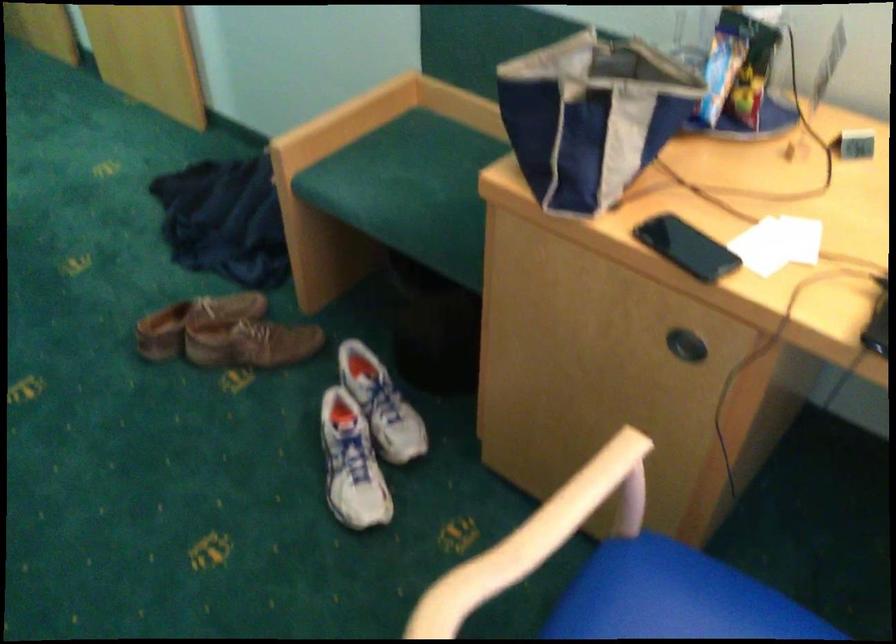
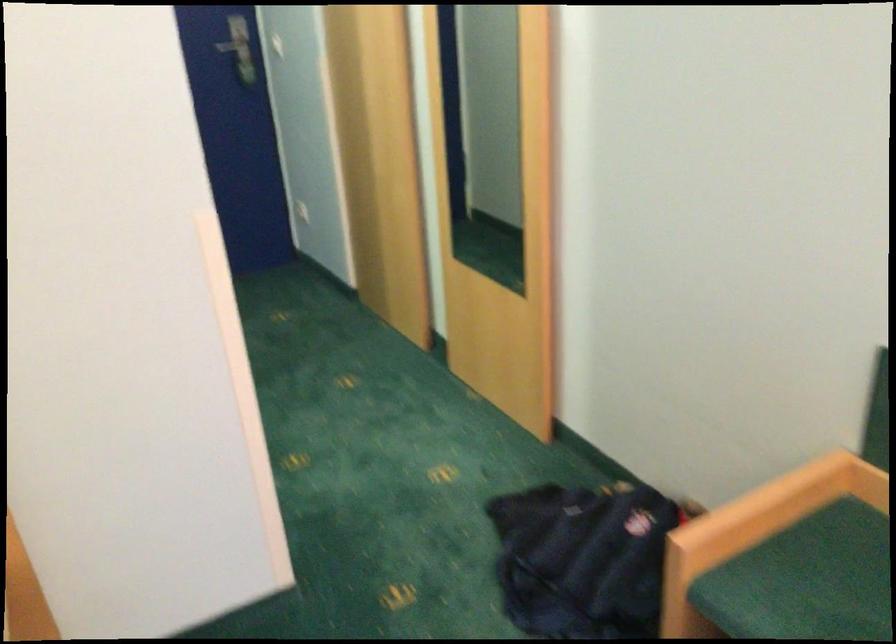
The point at [375,164] is marked in the first image. Where is the corresponding point in the second image?

(806, 580)